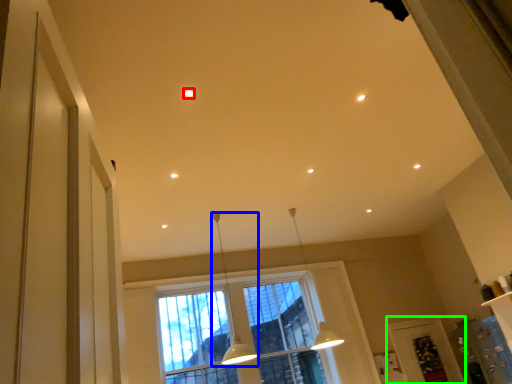
Question: Which object is the farthest from lighting (highlighted by a red box)? Choose among these: lamp (highlighted by a blue box) or screen door (highlighted by a green box).

Choices:
 (A) lamp
 (B) screen door

Answer: (B)